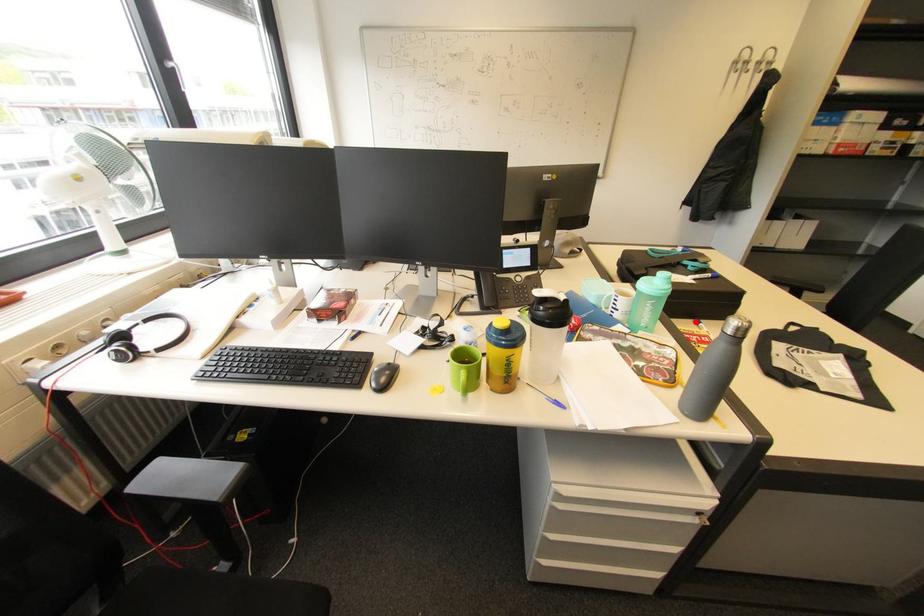
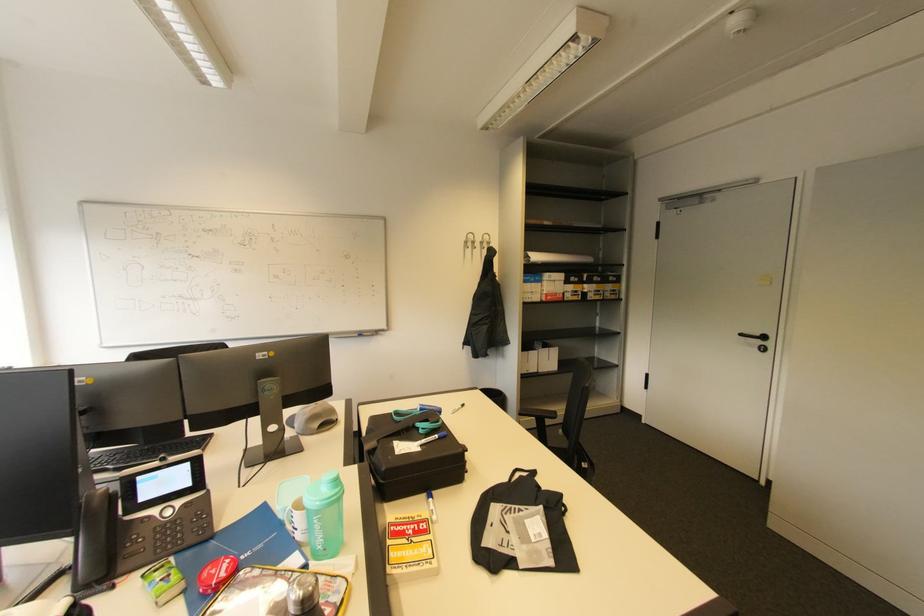
The point at the highlighted location is marked in the first image. Where is the corresponding point in the second image?

(429, 496)